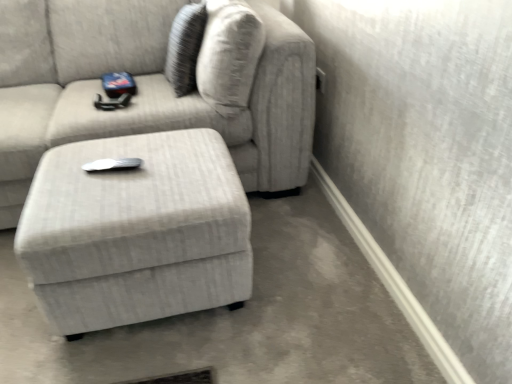
This screenshot has height=384, width=512. I want to click on free point above light gray fabric ottoman at center (from a real-world perspective), so click(x=136, y=167).